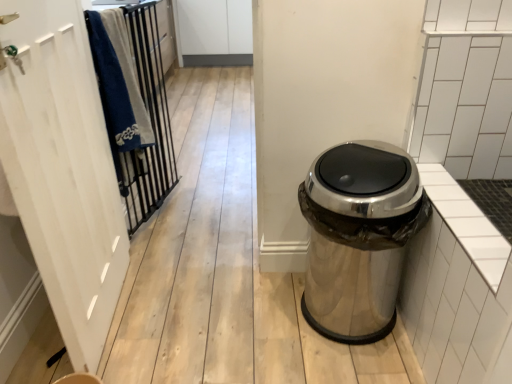
Question: Is white wood screen door at left situated inside polished metallic trash can at right or outside?

Choices:
 (A) inside
 (B) outside

Answer: (B)

Question: From the image's perspective, is white wood screen door at left above or below polished metallic trash can at right?

Choices:
 (A) below
 (B) above

Answer: (B)

Question: Which of these objects is positioned farthest from the metallic black bars at left?

Choices:
 (A) polished metallic trash can at right
 (B) white wood screen door at left

Answer: (A)

Question: Which of these objects is positioned farthest from the polished metallic trash can at right?

Choices:
 (A) metallic black bars at left
 (B) white wood screen door at left

Answer: (A)